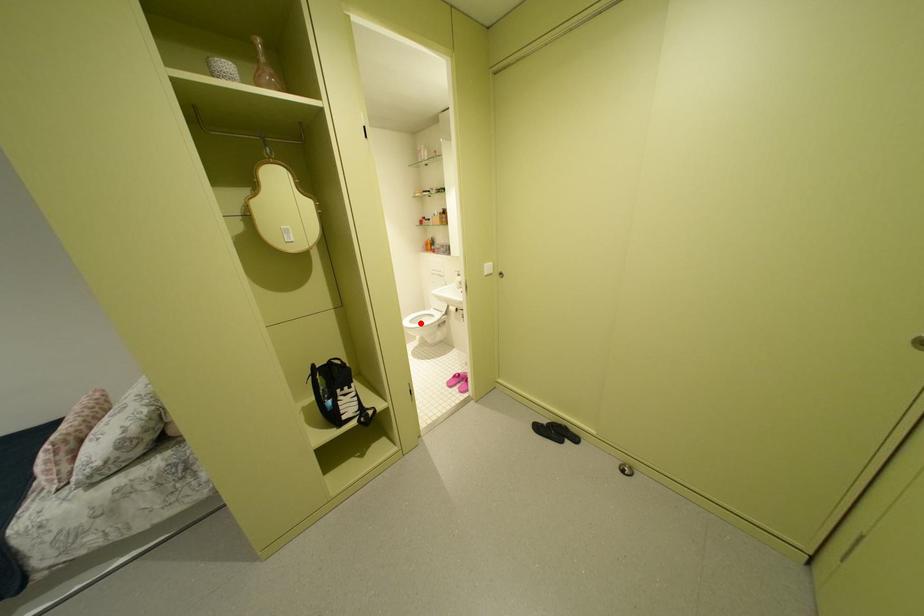
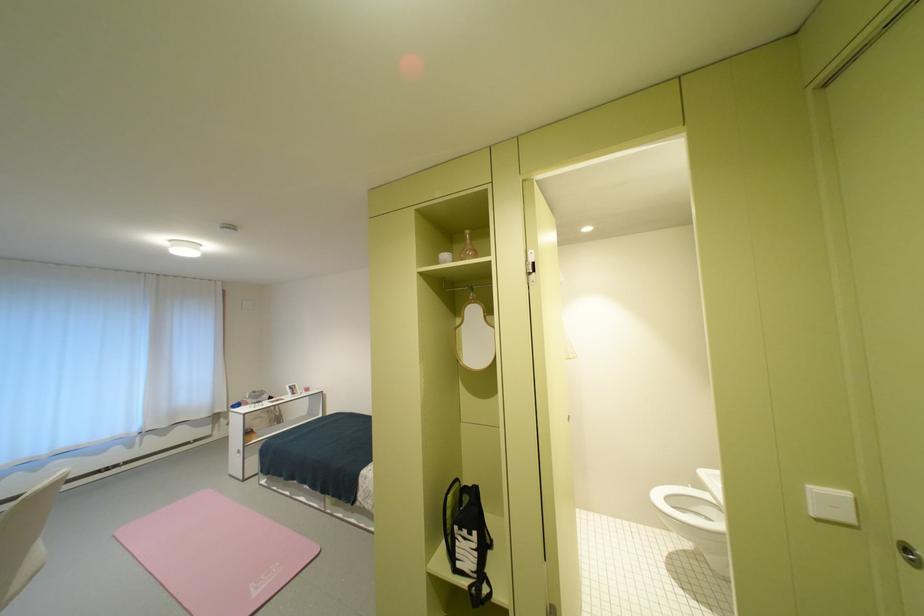
Question: I am providing you with two images of the same scene from different viewpoints. Given a red point in image1, look at the same physical point in image2. Is it:

Choices:
 (A) Closer to the viewpoint
 (B) Farther from the viewpoint

Answer: (B)